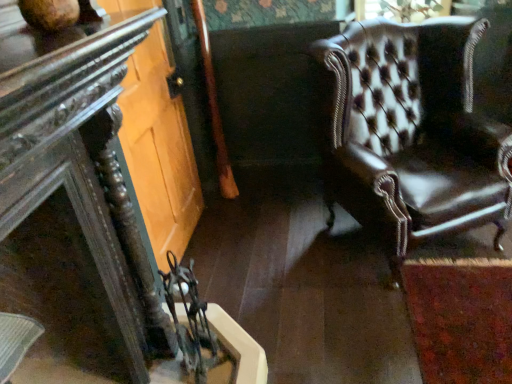
Question: Is the surface of dark wood table at left in direct contact with leather armchair at right?

Choices:
 (A) no
 (B) yes

Answer: (A)

Question: Is leather armchair at right completely or partially inside dark wood table at left?

Choices:
 (A) no
 (B) yes

Answer: (A)

Question: Would you say dark wood table at left is a long distance from leather armchair at right?

Choices:
 (A) yes
 (B) no

Answer: (A)

Question: Is dark wood table at left taller than leather armchair at right?

Choices:
 (A) yes
 (B) no

Answer: (B)

Question: Is dark wood table at left positioned in front of leather armchair at right?

Choices:
 (A) yes
 (B) no

Answer: (A)

Question: From the image's perspective, does dark wood table at left appear lower than leather armchair at right?

Choices:
 (A) yes
 (B) no

Answer: (A)

Question: From a real-world perspective, is leather armchair at right located higher than dark wood table at left?

Choices:
 (A) no
 (B) yes

Answer: (A)

Question: Would you say dark wood table at left is part of leather armchair at right's contents?

Choices:
 (A) yes
 (B) no

Answer: (B)

Question: Is leather armchair at right looking in the opposite direction of dark wood table at left?

Choices:
 (A) no
 (B) yes

Answer: (A)

Question: From the image's perspective, is leather armchair at right beneath dark wood table at left?

Choices:
 (A) no
 (B) yes

Answer: (A)

Question: From the image's perspective, is leather armchair at right on dark wood table at left?

Choices:
 (A) yes
 (B) no

Answer: (A)

Question: Is leather armchair at right far from dark wood table at left?

Choices:
 (A) yes
 (B) no

Answer: (A)

Question: Is clear glass door at lower left located outside dark wood table at left?

Choices:
 (A) no
 (B) yes

Answer: (B)